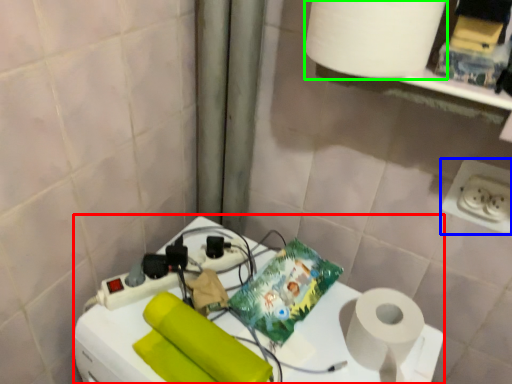
Question: Which is farther away from appliance (highlighted by a red box)? power plugs and sockets (highlighted by a blue box) or paper towel (highlighted by a green box)?

Choices:
 (A) power plugs and sockets
 (B) paper towel

Answer: (B)